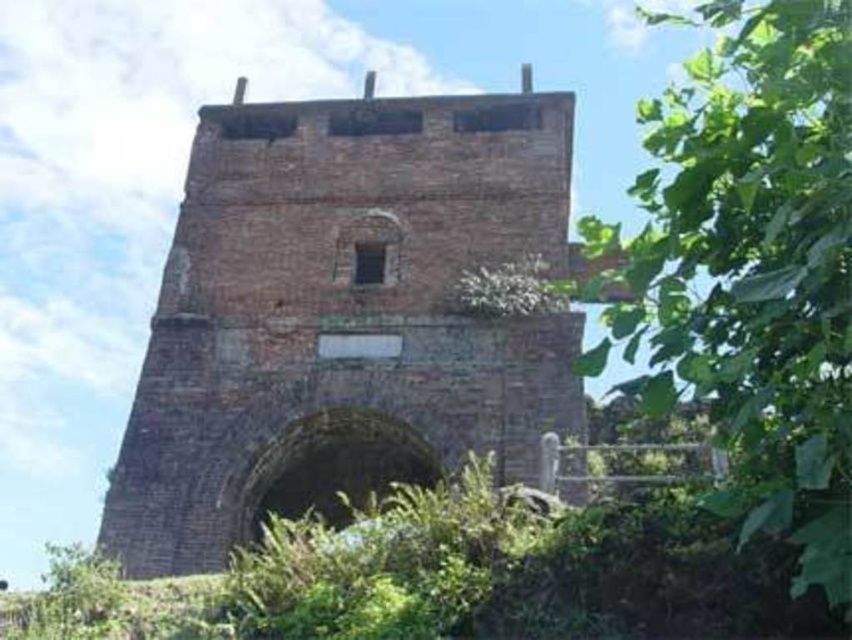
You are an architect examining an ancient structure. You notice the brown brick tower at center and the green leafy tree at right. Which object is closer to the viewer?

The brown brick tower at center is closer to the viewer because the green leafy tree at right is behind it.

You are an architect examining the brown brick tower at center and the green leafy tree at right in the image. Which structure has a wider base?

The green leafy tree at right has a greater width than the brown brick tower at center, so the green leafy tree at right has a wider base.

You are standing in front of the ancient brick structure and want to take a photo of both the brown brick tower at center and the green leafy tree at right. Based on their positions, which object should you frame first in your camera viewfinder to include both in the shot?

The brown brick tower at center is positioned on the left side of green leafy tree at right, so you should frame the brown brick tower at center first on the left and then include the green leafy tree at right to the right of it in the viewfinder.